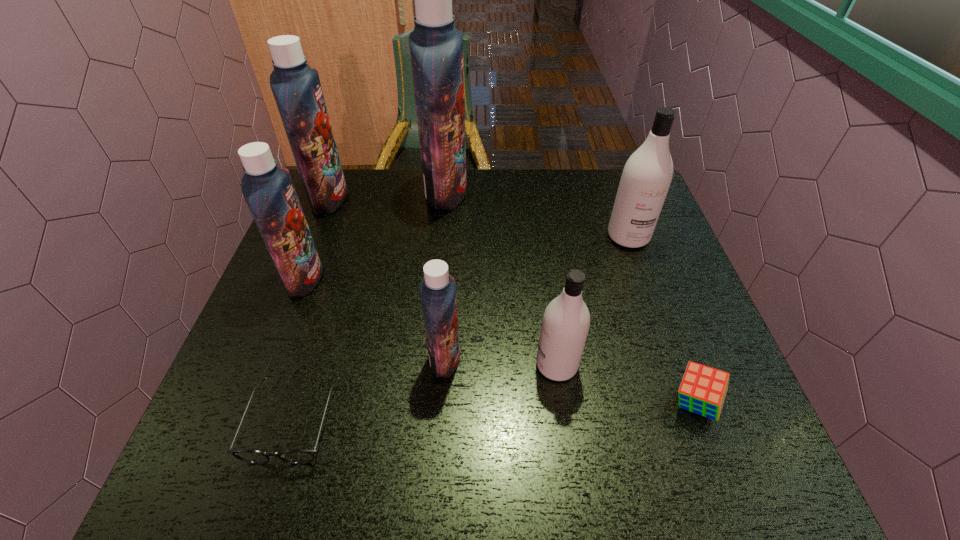
Find the location of a particular element. free space at the far edge of the desktop is located at coordinates (394, 201).

Locate an element on the screen. vacant space at the left edge of the desktop is located at coordinates (278, 384).

Locate an element on the screen. vacant space at the right edge is located at coordinates (660, 391).

Find the location of a particular element. vacant space at the far left corner of the desktop is located at coordinates (338, 209).

In the image, there is a desktop. What are the coordinates of `vacant region at the near left corner` in the screenshot? It's located at (257, 469).

Identify the location of blank space at the near right corner of the desktop. Image resolution: width=960 pixels, height=540 pixels. (769, 468).

I want to click on free point between the red cube and the fourth farthest shampoo, so click(x=499, y=341).

Identify the location of free spot between the third farthest shampoo and the second shortest object. The image size is (960, 540). (661, 320).

The image size is (960, 540). In order to click on vacant area between the second biggest blue shampoo and the cube in this screenshot , I will do `click(512, 301)`.

The height and width of the screenshot is (540, 960). I want to click on vacant area that lies between the spectacles and the seventh shortest object, so click(311, 310).